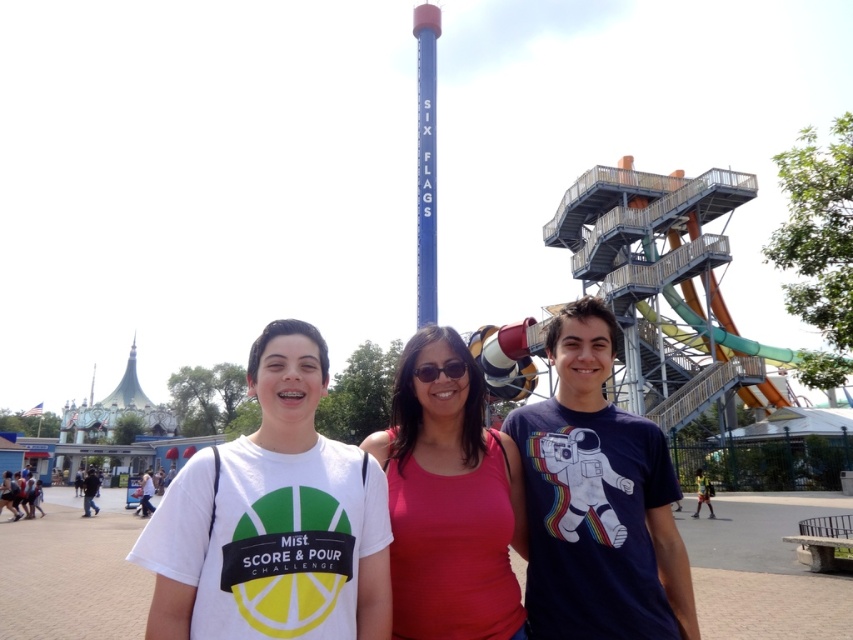
Question: Based on their relative distances, which object is nearer to the blue metallic pole at center?

Choices:
 (A) black plastic sunglasses at center
 (B) red matte tank top at center

Answer: (B)

Question: Among these points, which one is farthest from the camera?

Choices:
 (A) tap(457, 515)
 (B) tap(454, 358)
 (C) tap(426, 154)

Answer: (C)

Question: Does red matte tank top at center lie behind blue metallic pole at center?

Choices:
 (A) yes
 (B) no

Answer: (B)

Question: Can you confirm if red matte tank top at center is bigger than black plastic sunglasses at center?

Choices:
 (A) no
 (B) yes

Answer: (B)

Question: Does blue metallic pole at center have a smaller size compared to black plastic sunglasses at center?

Choices:
 (A) yes
 (B) no

Answer: (B)

Question: Which object is positioned closest to the black plastic sunglasses at center?

Choices:
 (A) red matte tank top at center
 (B) blue metallic pole at center

Answer: (A)